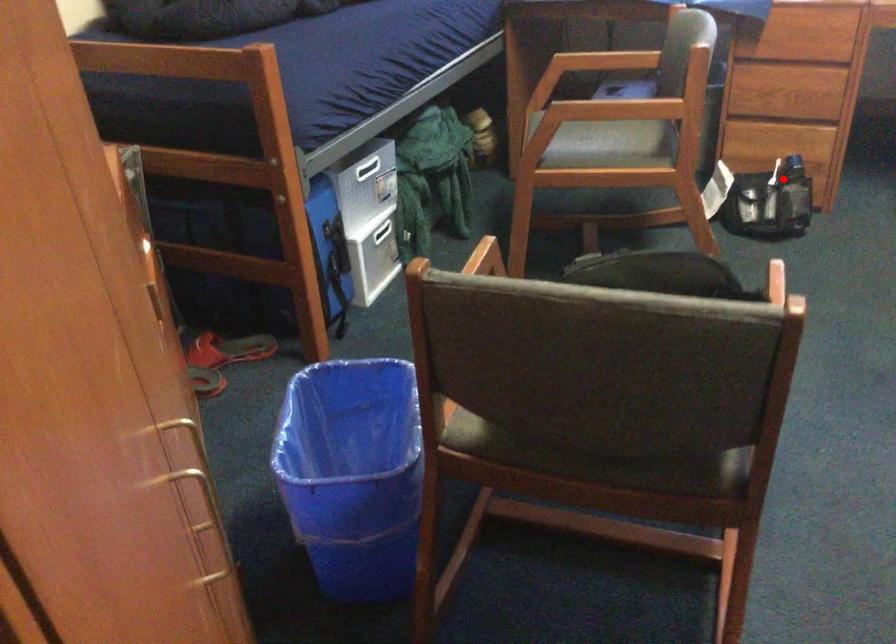
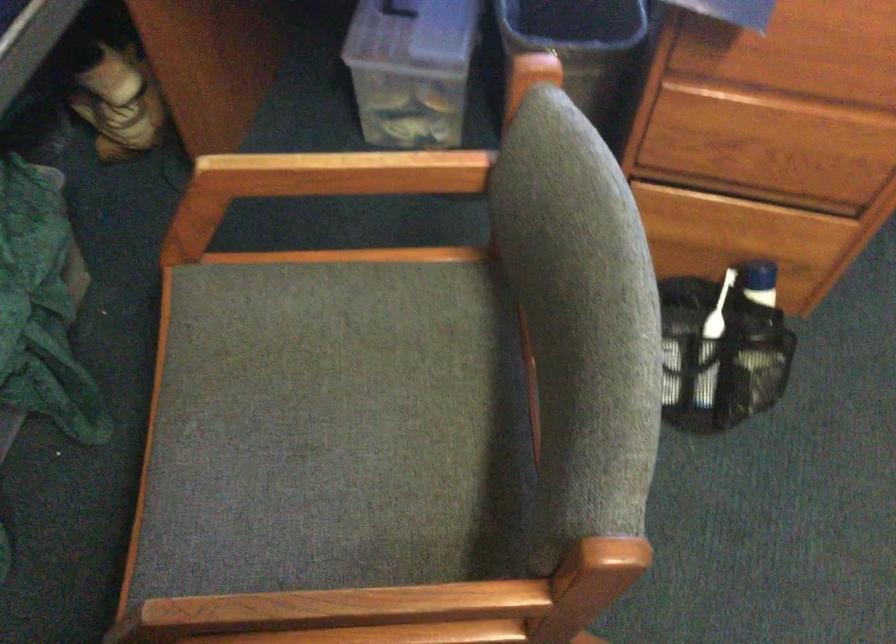
The point at the highlighted location is marked in the first image. Where is the corresponding point in the second image?

(719, 308)